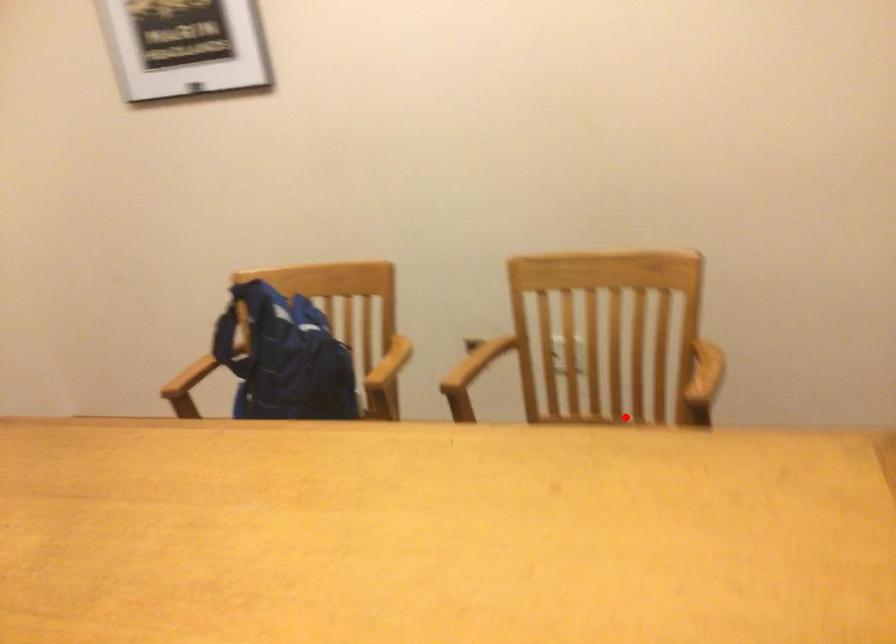
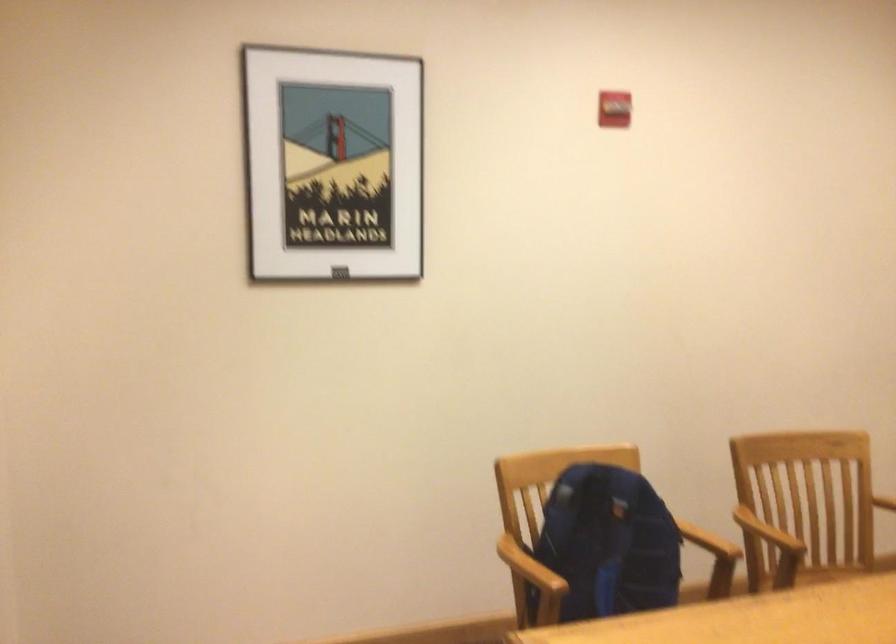
In the second image, find the point that corresponds to the highlighted location in the first image.

(837, 572)